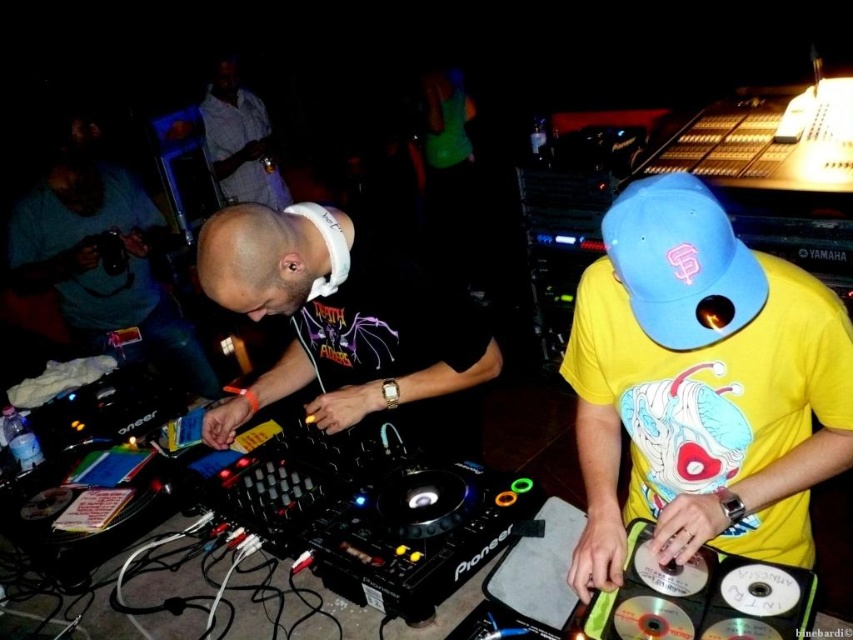
Question: Which point is farther from the camera taking this photo?

Choices:
 (A) (428, 342)
 (B) (178, 369)

Answer: (B)

Question: Is yellow matte shirt at center above striped shirt at upper left?

Choices:
 (A) yes
 (B) no

Answer: (B)

Question: Which of the following is the farthest from the observer?

Choices:
 (A) yellow matte shirt at center
 (B) striped shirt at upper left
 (C) white matte headphones at center
 (D) matte blue cap at left

Answer: (B)

Question: Can you confirm if yellow matte shirt at center is positioned to the left of striped shirt at upper left?

Choices:
 (A) yes
 (B) no

Answer: (B)

Question: Among these objects, which one is farthest from the camera?

Choices:
 (A) matte blue cap at left
 (B) striped shirt at upper left
 (C) yellow matte shirt at center
 (D) white matte headphones at center

Answer: (B)

Question: Can you confirm if white matte headphones at center is positioned above striped shirt at upper left?

Choices:
 (A) no
 (B) yes

Answer: (A)